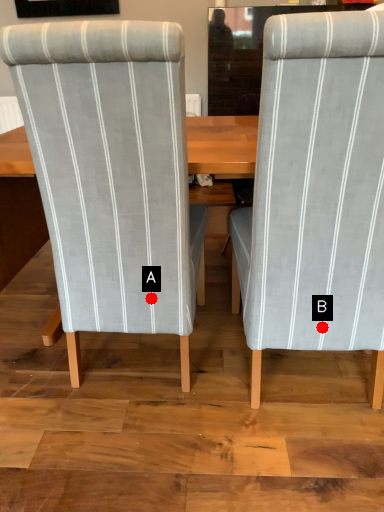
Question: Two points are circled on the image, labeled by A and B beside each circle. Among these points, which one is nearest to the camera?

Choices:
 (A) A is closer
 (B) B is closer

Answer: (B)